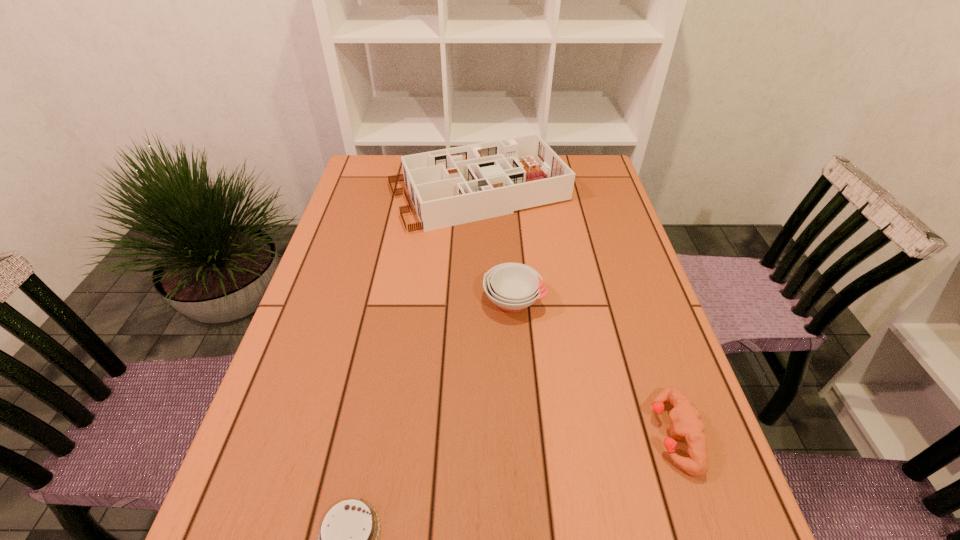
Identify the location of free space between the third nearest object and the farthest object. (496, 247).

The height and width of the screenshot is (540, 960). Identify the location of empty location between the soup bowl and the farthest object. (496, 247).

Find the location of a particular element. This screenshot has height=540, width=960. unoccupied position between the rightmost object and the farthest object is located at coordinates (576, 314).

This screenshot has height=540, width=960. In order to click on vacant space that's between the third nearest object and the dollhouse in this screenshot , I will do `click(496, 247)`.

Locate an element on the screen. This screenshot has width=960, height=540. free space that is in between the tallest object and the puncher is located at coordinates (576, 314).

Identify the location of the closest object to the second farthest object. (453, 186).

Locate an element on the screen. object that stands as the third closest to the shortest object is located at coordinates (453, 186).

This screenshot has height=540, width=960. What are the coordinates of `free space that satisfies the following two spatial constraints: 1. on the front side of the farthest object; 2. on the right side of the soup bowl` in the screenshot? It's located at pyautogui.click(x=479, y=301).